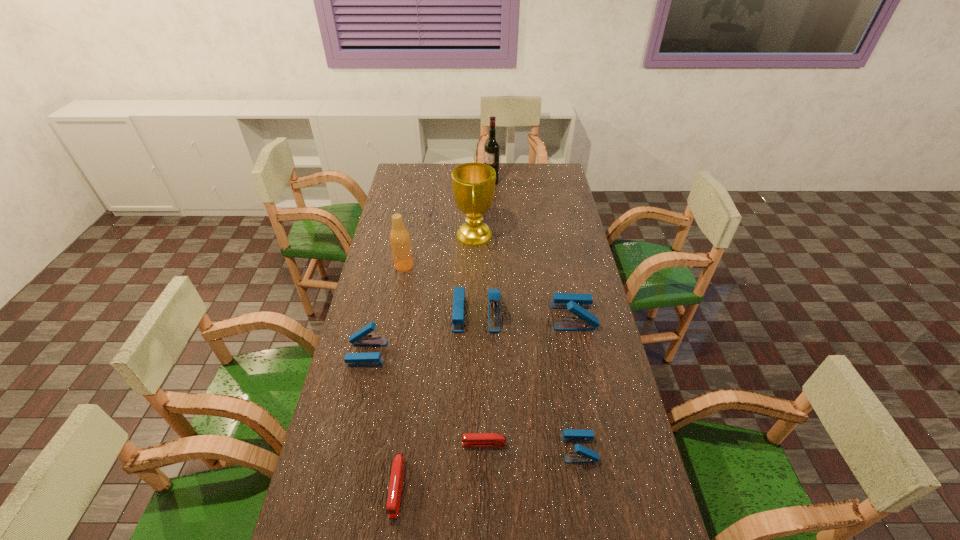
At what (x,y) coordinates should I click in order to perform the action: click on the second nearest blue stapler. Please return your answer as a coordinate pair (x, y). Looking at the image, I should click on (360, 338).

Where is `the fourth tallest stapler`? the fourth tallest stapler is located at coordinates (583, 454).

The image size is (960, 540). I want to click on the nearest blue stapler, so click(583, 454).

Locate an element on the screen. the left red stapler is located at coordinates (397, 473).

I want to click on the third object from left to right, so click(397, 473).

Where is `the right red stapler`? Image resolution: width=960 pixels, height=540 pixels. the right red stapler is located at coordinates (468, 439).

Identify the location of the smaller red stapler. The width and height of the screenshot is (960, 540). (468, 439).

The width and height of the screenshot is (960, 540). Find the location of `free space located 0.360m on the front and back of the farthest object`. free space located 0.360m on the front and back of the farthest object is located at coordinates (413, 183).

Locate an element on the screen. free space located 0.320m on the front and back of the farthest object is located at coordinates (420, 183).

Identify the location of blank space located on the front and back of the farthest object. This screenshot has width=960, height=540. (405, 183).